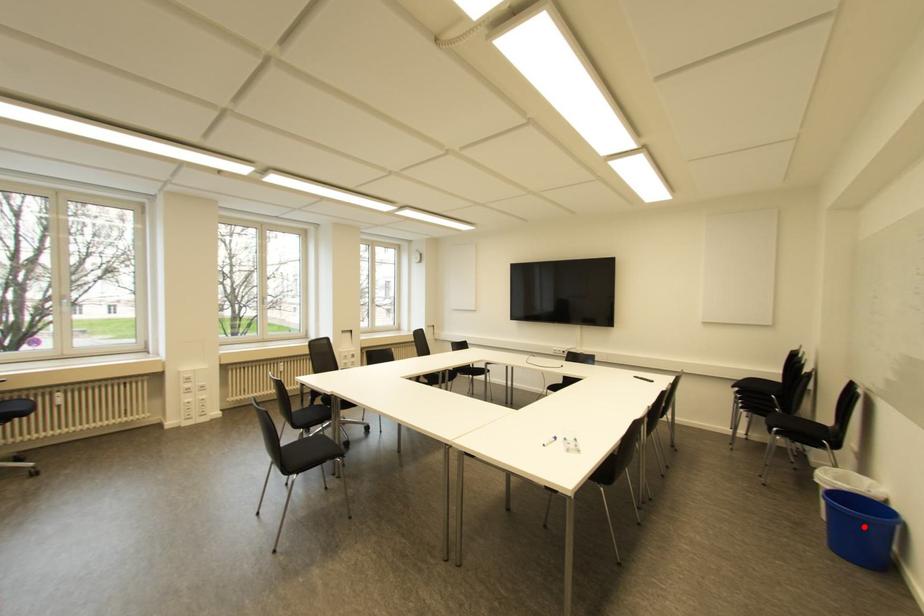
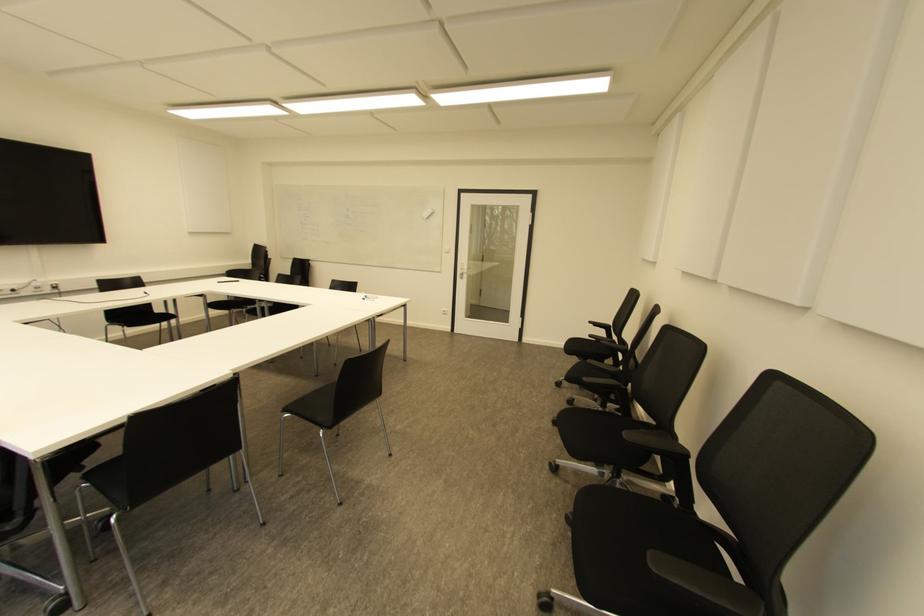
Question: I am providing you with two images of the same scene from different viewpoints. A red point is marked on the first image. Is the red point's position out of view in image 2?

Choices:
 (A) Yes
 (B) No

Answer: (A)